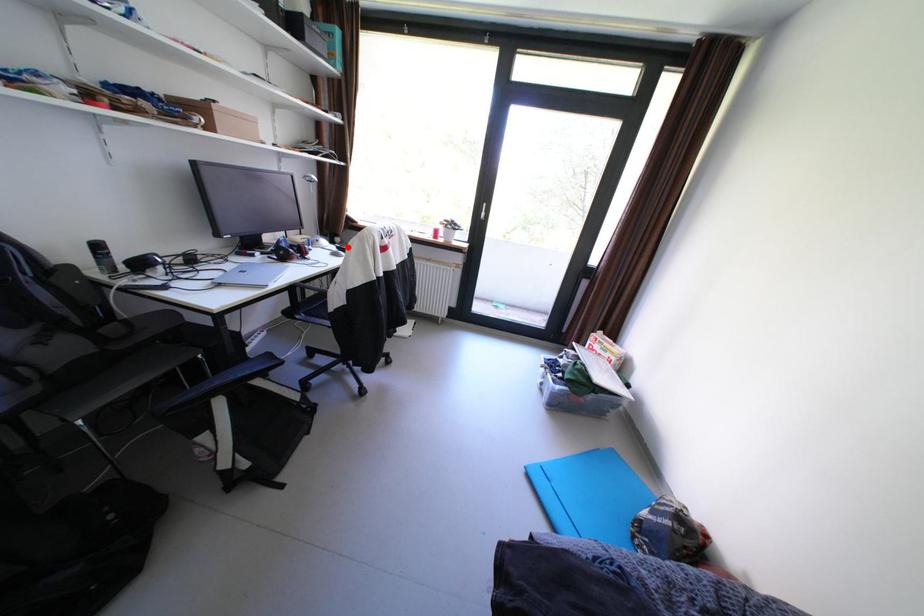
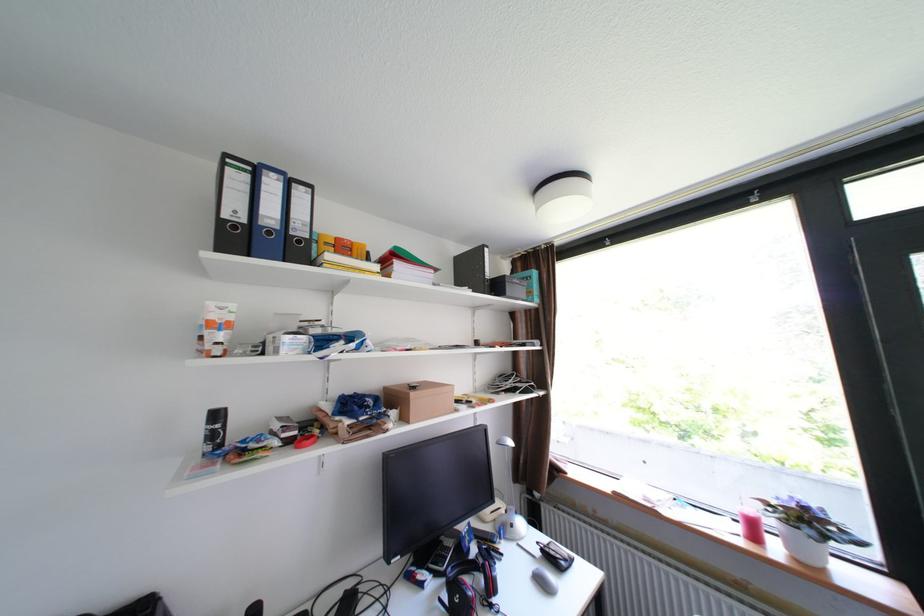
Question: I am providing you with two images of the same scene from different viewpoints. Image1 has a red point marked. In image2, the corresponding 3D location appears at what relative position? Reply with the corresponding letter.

Choices:
 (A) Closer
 (B) Farther

Answer: (A)